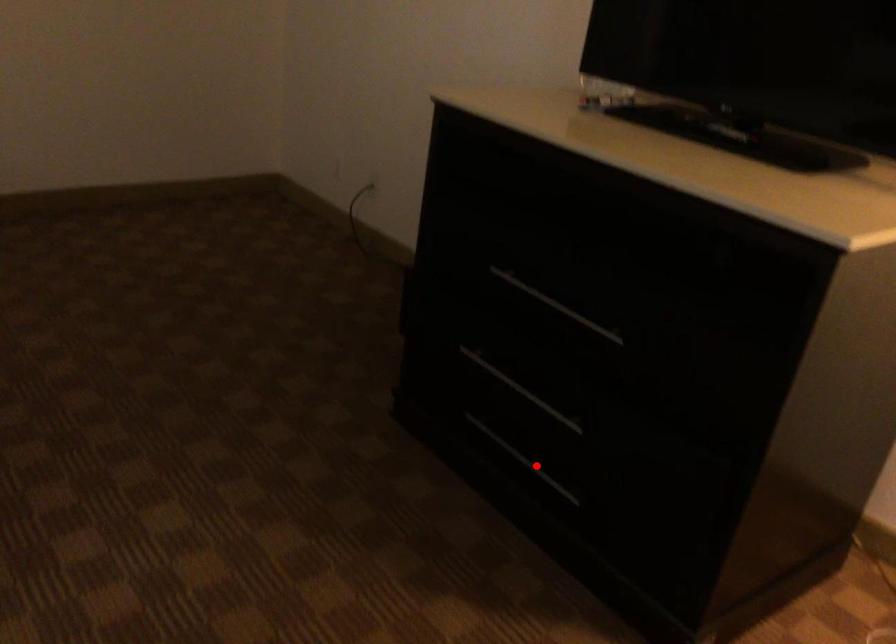
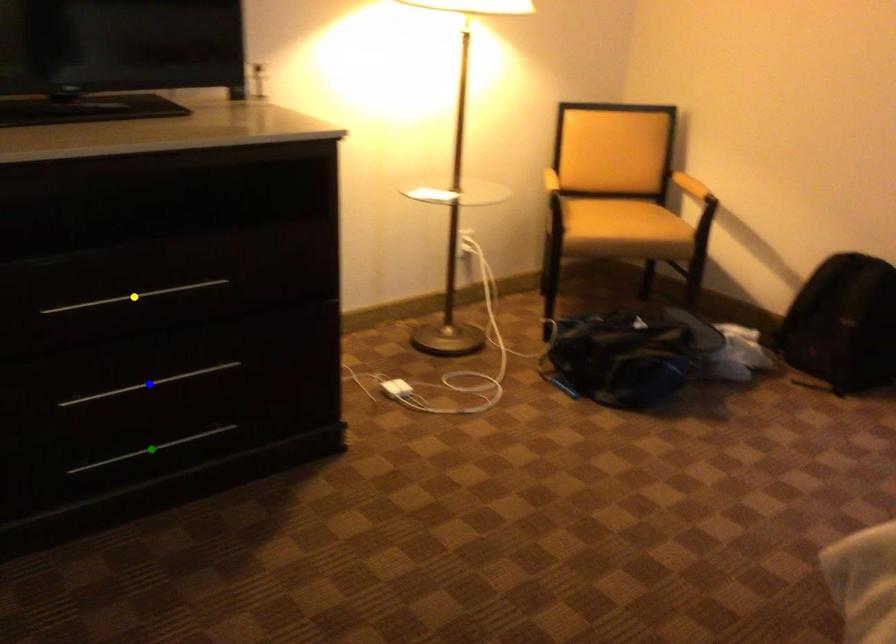
Question: I am providing you with two images of the same scene from different viewpoints. A red point is marked on the first image. You are given multiple points on the second image. Which point in image 2 represents the same 3d spot as the red point in image 1?

Choices:
 (A) green point
 (B) yellow point
 (C) blue point

Answer: (A)